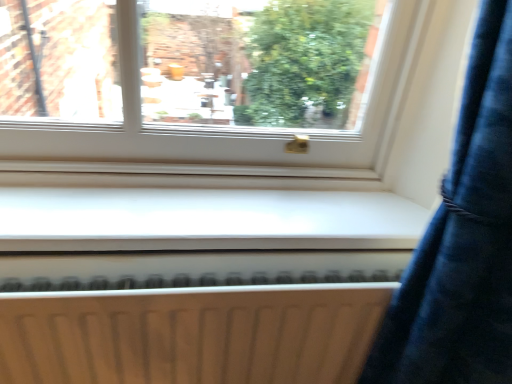
Question: Does white matte radiator at lower center appear on the right side of white smooth window sill at center?

Choices:
 (A) no
 (B) yes

Answer: (A)

Question: Can you confirm if white matte radiator at lower center is smaller than white smooth window sill at center?

Choices:
 (A) yes
 (B) no

Answer: (B)

Question: Could you tell me if white matte radiator at lower center is turned towards white smooth window sill at center?

Choices:
 (A) yes
 (B) no

Answer: (B)

Question: Is white matte radiator at lower center placed right next to white smooth window sill at center?

Choices:
 (A) no
 (B) yes

Answer: (A)

Question: Is white matte radiator at lower center turned away from white smooth window sill at center?

Choices:
 (A) yes
 (B) no

Answer: (B)

Question: From a real-world perspective, does white matte radiator at lower center sit lower than white smooth window sill at center?

Choices:
 (A) no
 (B) yes

Answer: (B)

Question: Does white smooth window sill at center appear on the left side of white matte radiator at lower center?

Choices:
 (A) yes
 (B) no

Answer: (B)

Question: Is there a large distance between white smooth window sill at center and white matte radiator at lower center?

Choices:
 (A) yes
 (B) no

Answer: (B)

Question: Is white smooth window sill at center outside white matte radiator at lower center?

Choices:
 (A) yes
 (B) no

Answer: (A)

Question: Is white smooth window sill at center oriented away from white matte radiator at lower center?

Choices:
 (A) no
 (B) yes

Answer: (A)

Question: From a real-world perspective, is white smooth window sill at center located beneath white matte radiator at lower center?

Choices:
 (A) yes
 (B) no

Answer: (B)

Question: Can white matte radiator at lower center be found inside white smooth window sill at center?

Choices:
 (A) no
 (B) yes

Answer: (A)

Question: Looking at the image, does white matte radiator at lower center seem bigger or smaller compared to white smooth window sill at center?

Choices:
 (A) small
 (B) big

Answer: (B)